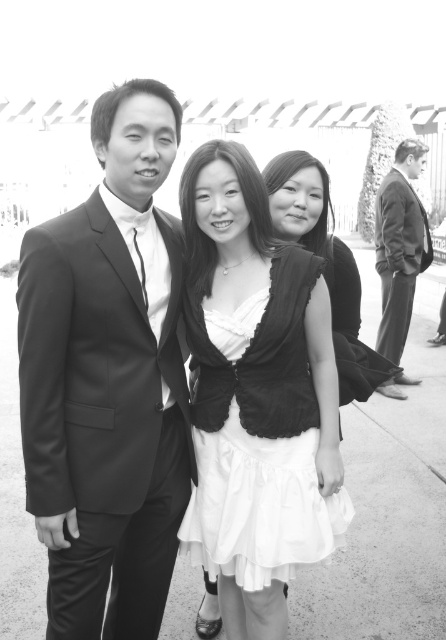
You are a photographer who needs to decide the placement of two subjects for a group photo. The subjects are the white satin dress at center and the dark suit at right. Based on their body proportions, which subject should you place closer to the camera to maintain a balanced composition?

The white satin dress at center should be placed closer to the camera because it is thinner than the dark suit at right, creating a balanced composition by compensating for the difference in their sizes.

You are a photographer who needs to adjust the composition of the image to ensure all three subjects are visible. Given the smooth black suit at left and the dark suit at right, which one should you move closer to the center to avoid cropping?

Since the smooth black suit at left occupies less space than the dark suit at right, moving the dark suit at right closer to the center would help balance the composition and ensure both are visible without cropping.